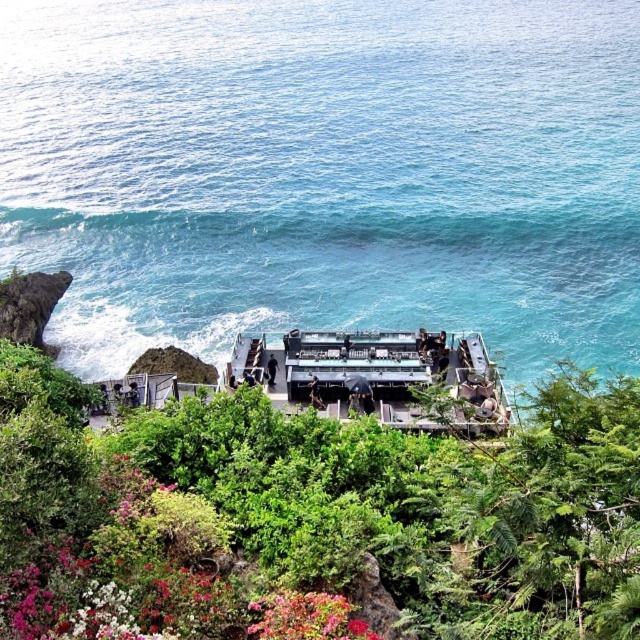
You are standing at the cliffside restaurant and looking out towards the ocean. You notice a metallic gray boat at center and vibrant red petals at lower center. Which object is closer to you?

The metallic gray boat at center is closer to you than the vibrant red petals at lower center because it is further to the viewer.

You are standing at the cliffside restaurant and want to take a photo of the metallic gray boat at center. If your camera has a maximum zoom range of 100 feet, will you be able to capture a clear photo without moving closer?

The metallic gray boat at center is 103.68 feet away from the viewer. Since the camera can only zoom up to 100 feet, it won not be able to capture a clear photo without moving closer.

You are a landscape architect designing a garden path that must pass between the green leafy foliage at center and the vibrant red petals at lower center. Which side of the path should you place the wider plant to ensure the path remains narrow enough for a single person to walk through comfortably?

The green leafy foliage at center is wider than the vibrant red petals at lower center. To keep the path narrow enough for a single person, place the wider green leafy foliage at center on one side of the path and the narrower vibrant red petals at lower center on the other side.